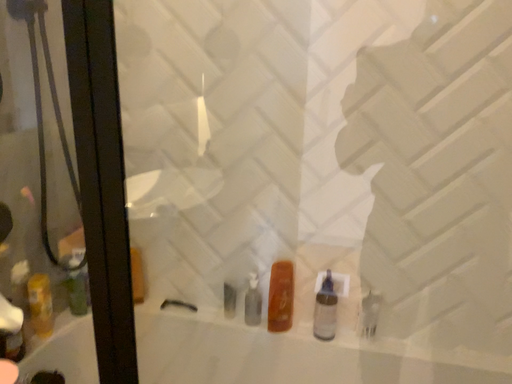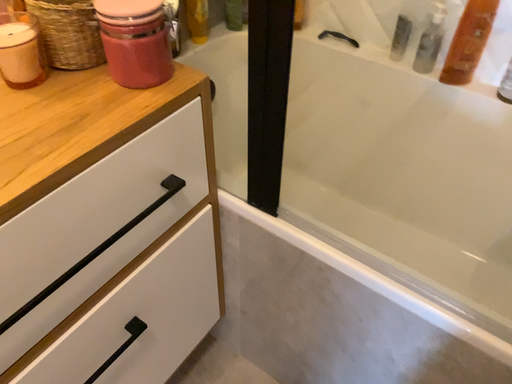
Question: Which way did the camera rotate in the video?

Choices:
 (A) rotated right
 (B) rotated left

Answer: (B)